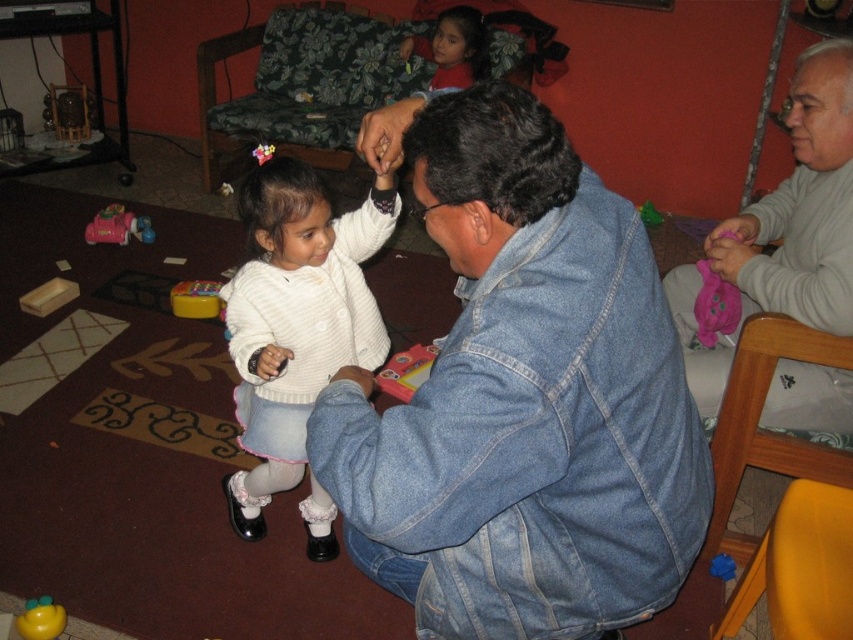
Question: Which object is the farthest from the gray sweater at upper right?

Choices:
 (A) white sweater at center
 (B) matte plastic toy at center
 (C) yellow plastic toy at center

Answer: (C)

Question: Which point is farther to the camera?

Choices:
 (A) yellow plastic toy at center
 (B) rubberized plastic toy at lower left

Answer: (B)

Question: Considering the real-world distances, which object is closest to the matte red sweater at upper center?

Choices:
 (A) matte plastic toy at center
 (B) gray sweater at upper right

Answer: (A)

Question: Does rubberized plastic toy at lower left have a larger size compared to yellow rubber duck at lower left?

Choices:
 (A) no
 (B) yes

Answer: (B)

Question: Is gray sweater at upper right above yellow plastic toy at center?

Choices:
 (A) yes
 (B) no

Answer: (A)

Question: Does denim jacket at lower right appear on the left side of yellow rubber duck at lower left?

Choices:
 (A) yes
 (B) no

Answer: (B)